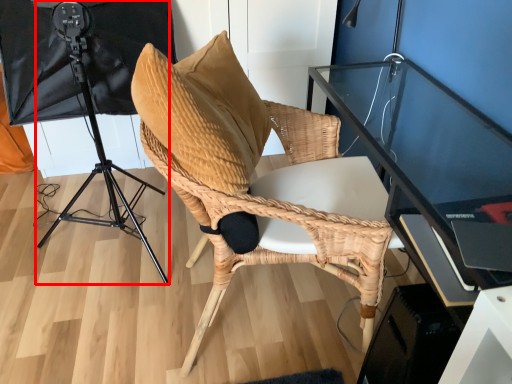
Question: In this image, where is tripod (annotated by the red box) located relative to chair?

Choices:
 (A) right
 (B) left

Answer: (B)